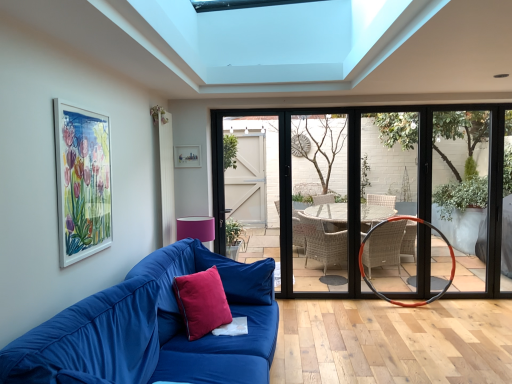
Where is `vacant space situated above white glossy picture frame at upper left, the first picture frame positioned from the front (from a real-world perspective)`? This screenshot has width=512, height=384. vacant space situated above white glossy picture frame at upper left, the first picture frame positioned from the front (from a real-world perspective) is located at coordinates (81, 104).